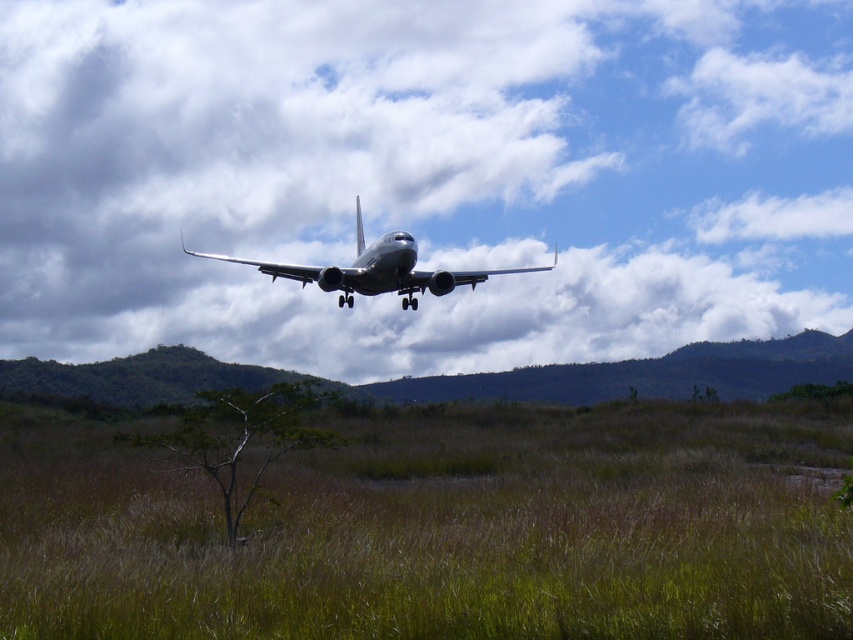
You are a pilot trying to navigate your airplane to land safely. You notice a white fluffy cloud at upper center. Based on the coordinates provided, can you determine if the cloud is directly above your current flight path? Please explain your reasoning.

The white fluffy cloud at upper center is located at coordinates (422, 177). Since the airplane is positioned centrally in the frame and the cloud is at upper center, it is likely positioned above the flight path. However, without additional information about the flight path coordinates, we cannot definitively confirm if the cloud is directly above.

You are a pilot preparing for landing. You notice the white fluffy cloud at upper center and the brown dry grass at center in your view. Which object is positioned to the right side of your view?

The white fluffy cloud at upper center is positioned to the right of the brown dry grass at center.

You are a pilot trying to navigate your airplane to land safely. You need to avoid the white fluffy cloud at upper center. Based on the coordinates provided, can you determine if the cloud is directly above your current flight path? The airport runway is located below the airplane in the grassy field.

The white fluffy cloud at upper center is located at coordinates point (422, 177). Since the airplane is positioned centrally in the frame and the cloud is at upper center, it is likely positioned above the flight path. To avoid collision, the pilot should adjust the descent angle or course slightly to the right or left.